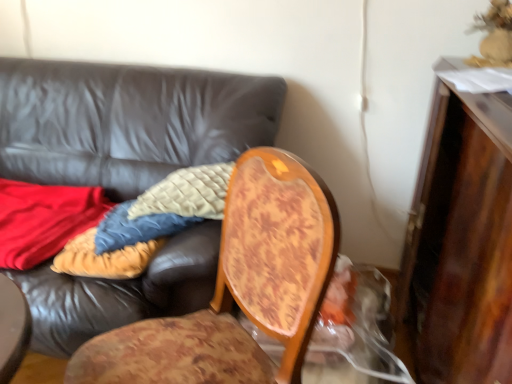
Question: Should I look upward or downward to see wooden chair at center?

Choices:
 (A) up
 (B) down

Answer: (B)

Question: Is there a large distance between wooden chair at center and leather couch at center?

Choices:
 (A) yes
 (B) no

Answer: (B)

Question: From the image's perspective, is wooden chair at center beneath leather couch at center?

Choices:
 (A) yes
 (B) no

Answer: (A)

Question: Does wooden chair at center have a lesser height compared to leather couch at center?

Choices:
 (A) yes
 (B) no

Answer: (A)

Question: Could you tell me if wooden chair at center is turned towards leather couch at center?

Choices:
 (A) no
 (B) yes

Answer: (A)

Question: Can leather couch at center be found inside wooden chair at center?

Choices:
 (A) no
 (B) yes

Answer: (A)

Question: Are wooden chair at center and leather couch at center making contact?

Choices:
 (A) yes
 (B) no

Answer: (B)

Question: Is wooden chair at center at the back of wooden dresser at right?

Choices:
 (A) no
 (B) yes

Answer: (A)

Question: Considering the relative sizes of wooden dresser at right and wooden chair at center in the image provided, is wooden dresser at right smaller than wooden chair at center?

Choices:
 (A) no
 (B) yes

Answer: (A)

Question: Is wooden dresser at right at the right side of wooden chair at center?

Choices:
 (A) yes
 (B) no

Answer: (A)

Question: Considering the relative positions of wooden dresser at right and wooden chair at center in the image provided, is wooden dresser at right in front of wooden chair at center?

Choices:
 (A) yes
 (B) no

Answer: (A)

Question: From a real-world perspective, is wooden dresser at right below wooden chair at center?

Choices:
 (A) no
 (B) yes

Answer: (A)

Question: Does wooden dresser at right come behind wooden chair at center?

Choices:
 (A) yes
 (B) no

Answer: (B)

Question: From a real-world perspective, is wooden chair at center over wooden dresser at right?

Choices:
 (A) no
 (B) yes

Answer: (A)